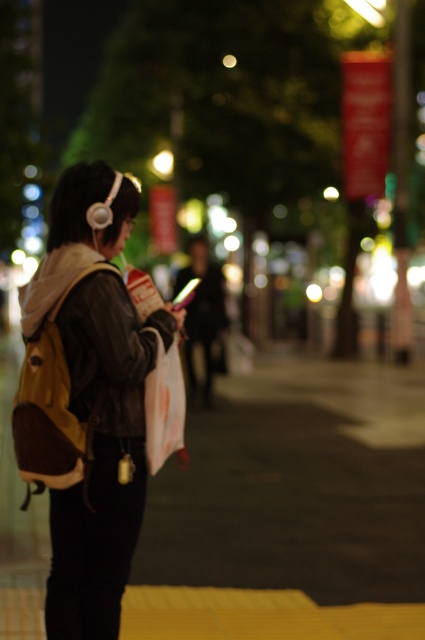
Between yellow asphalt at center and leather jacket at left, which one has more height?

leather jacket at left is taller.

Who is more distant from viewer, (357, 445) or (22, 436)?

Positioned behind is point (357, 445).

Locate an element on the screen. This screenshot has height=640, width=425. yellow asphalt at center is located at coordinates (297, 484).